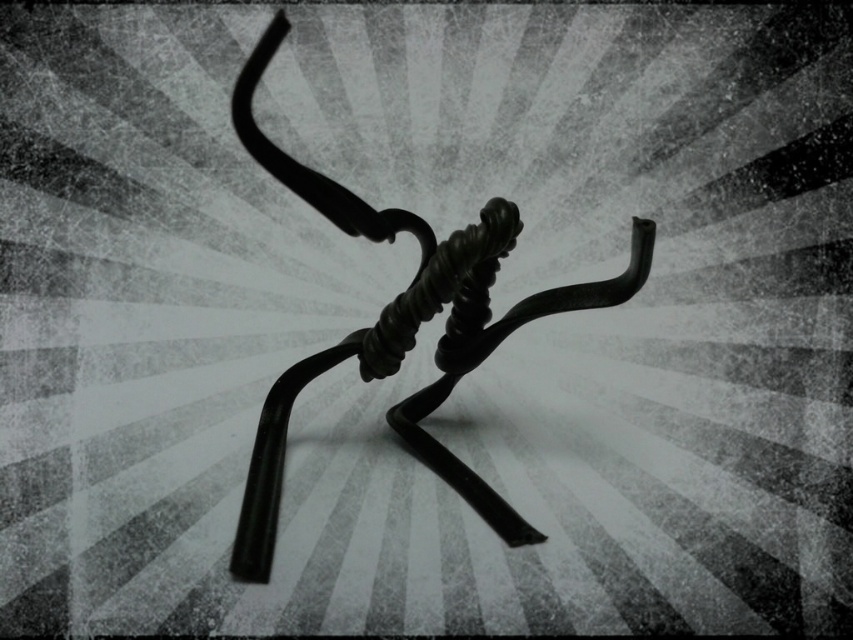
Between black matte wire sculpture at center and black rubber knot at center, which one appears on the right side from the viewer's perspective?

black rubber knot at center

Does black matte wire sculpture at center have a lesser height compared to black rubber knot at center?

No, black matte wire sculpture at center is not shorter than black rubber knot at center.

Which is in front, point (527, 538) or point (396, 340)?

Point (527, 538)

You are a GUI agent. You are given a task and a screenshot of the screen. Output one action in this format:
    pyautogui.click(x=<x>, y=<y>)
    Task: Click on the black matte wire sculpture at center
    This screenshot has width=853, height=640.
    Given the screenshot: What is the action you would take?
    pyautogui.click(x=401, y=324)